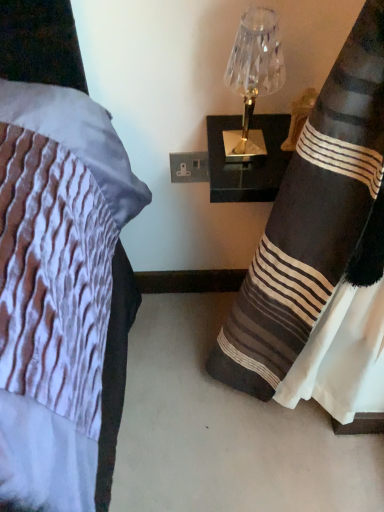
Question: Visually, is black striped fabric at right positioned to the left or to the right of clear glass lamp at upper right?

Choices:
 (A) right
 (B) left

Answer: (A)

Question: Is black striped fabric at right spatially inside clear glass lamp at upper right, or outside of it?

Choices:
 (A) outside
 (B) inside

Answer: (A)

Question: Is black striped fabric at right wider or thinner than clear glass lamp at upper right?

Choices:
 (A) thin
 (B) wide

Answer: (B)

Question: Would you say clear glass lamp at upper right is inside or outside black striped fabric at right?

Choices:
 (A) inside
 (B) outside

Answer: (B)

Question: From a real-world perspective, relative to black striped fabric at right, is clear glass lamp at upper right vertically above or below?

Choices:
 (A) below
 (B) above

Answer: (B)

Question: Looking at their shapes, would you say clear glass lamp at upper right is wider or thinner than black striped fabric at right?

Choices:
 (A) wide
 (B) thin

Answer: (B)

Question: Does point (273, 34) appear closer or farther from the camera than point (279, 350)?

Choices:
 (A) closer
 (B) farther

Answer: (A)